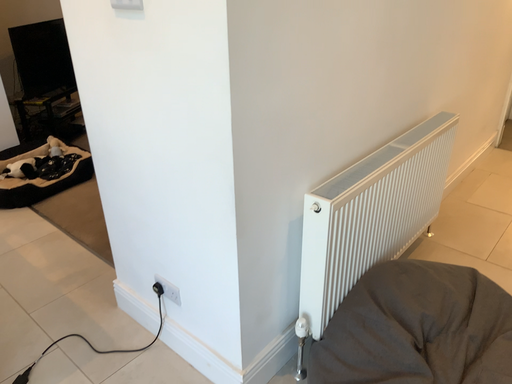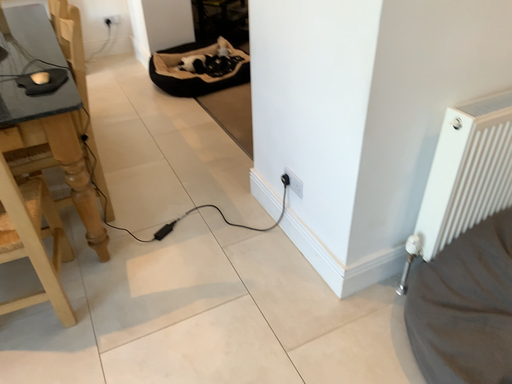
Question: Which way did the camera rotate in the video?

Choices:
 (A) rotated left
 (B) rotated right

Answer: (A)